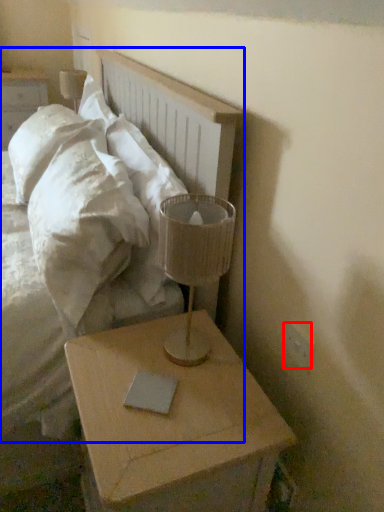
Question: Among these objects, which one is farthest to the camera, electric outlet (highlighted by a red box) or bed (highlighted by a blue box)?

Choices:
 (A) electric outlet
 (B) bed

Answer: (A)